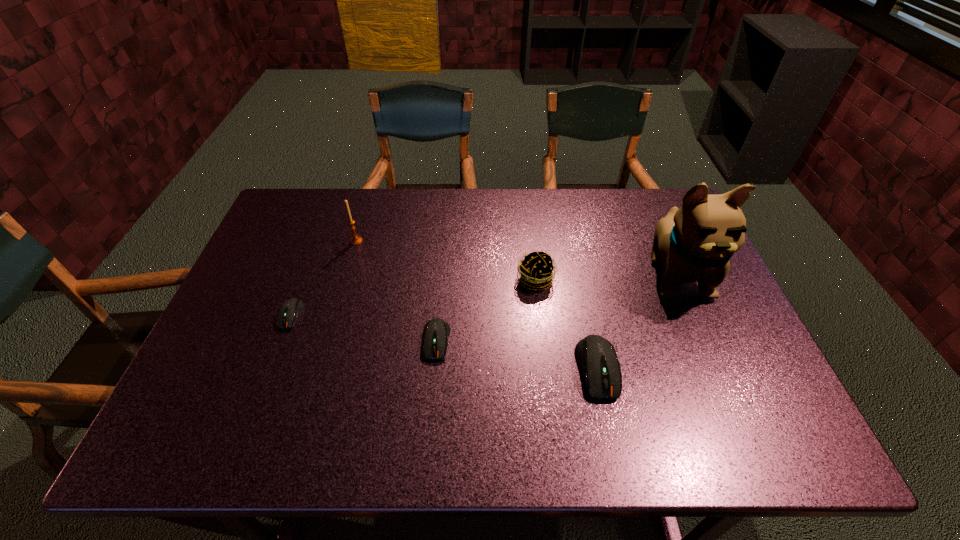
Identify the location of the shortest object. (289, 311).

The height and width of the screenshot is (540, 960). What are the coordinates of `the leftmost object` in the screenshot? It's located at (289, 311).

At what (x,y) coordinates should I click in order to perform the action: click on the second shortest computer equipment. Please return your answer as a coordinate pair (x, y). Looking at the image, I should click on (436, 331).

In order to click on the fifth tallest object in this screenshot , I will do `click(436, 331)`.

The width and height of the screenshot is (960, 540). What are the coordinates of `the tallest computer equipment` in the screenshot? It's located at (597, 357).

Image resolution: width=960 pixels, height=540 pixels. I want to click on the third shortest object, so click(597, 357).

Identify the location of the tallest object. (694, 243).

I want to click on puppy, so click(694, 243).

Where is `candle_holder`? This screenshot has width=960, height=540. candle_holder is located at coordinates pos(354,240).

Image resolution: width=960 pixels, height=540 pixels. I want to click on the second tallest object, so click(x=354, y=240).